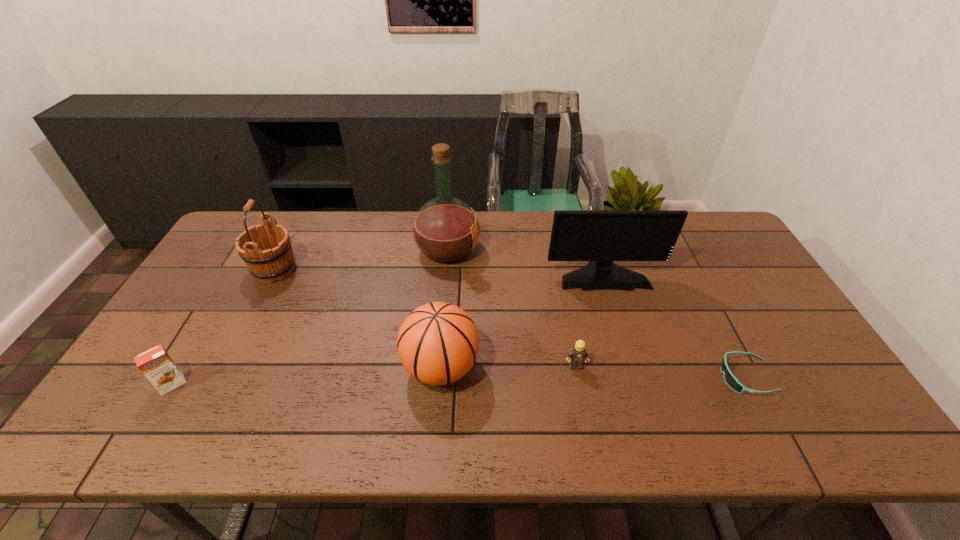
Find the location of `orange juice that is positioned at the left edge`. orange juice that is positioned at the left edge is located at coordinates (156, 364).

Where is `object that is positioned at the right edge`? The height and width of the screenshot is (540, 960). object that is positioned at the right edge is located at coordinates (730, 379).

What are the coordinates of `object that is at the far left corner` in the screenshot? It's located at pyautogui.click(x=266, y=249).

At what (x,y) coordinates should I click in order to perform the action: click on vacant space at the far edge of the desktop. Please return your answer as a coordinate pair (x, y). The width and height of the screenshot is (960, 540). Looking at the image, I should click on (369, 215).

What are the coordinates of `blank space at the near edge of the desktop` in the screenshot? It's located at (716, 426).

The image size is (960, 540). I want to click on vacant region at the right edge of the desktop, so click(716, 286).

Find the location of `empty space between the wine bucket and the monitor`. empty space between the wine bucket and the monitor is located at coordinates (439, 272).

Image resolution: width=960 pixels, height=540 pixels. I want to click on unoccupied position between the wine bucket and the shortest object, so click(x=510, y=323).

The image size is (960, 540). I want to click on vacant area that lies between the shortest object and the wine bucket, so click(x=510, y=323).

The image size is (960, 540). Identify the location of vacant space in between the Lego and the basketball. (508, 367).